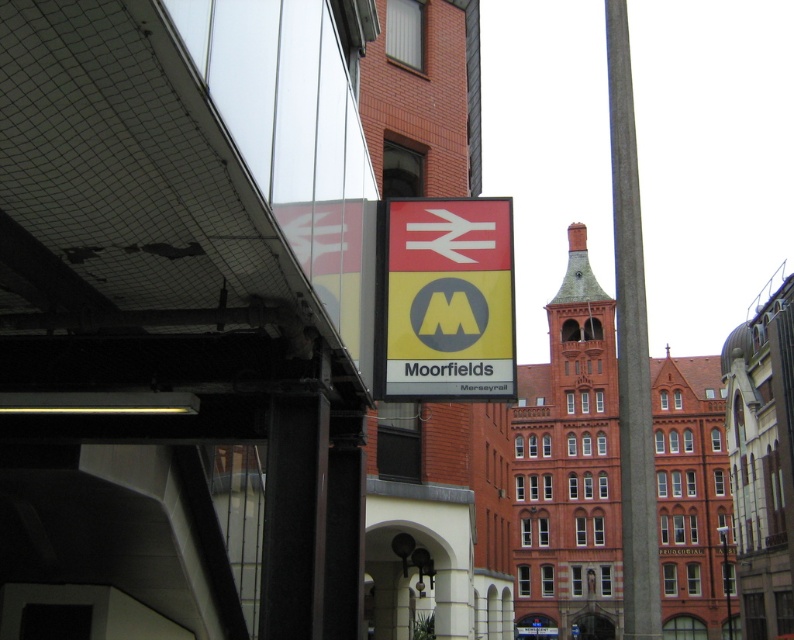
You are a passenger at the station and need to locate the yellow matte sign at center. Which object is closer to you if you are standing near the concrete pole at right?

The yellow matte sign at center is closer to you than the concrete pole at right because it is positioned at the center, while the concrete pole at right is further to the right side of the platform.

You are a delivery person trying to navigate through the station platform. You need to pass between the yellow matte sign at center and the concrete pole at right. Can you walk through the space between them without touching either?

The yellow matte sign at center has a lesser width compared to the concrete pole at right, so the space between them is sufficient for a person to walk through without touching either object.

You are a maintenance worker on the platform. You need to attach a new light fixture to the yellow matte sign at center and the concrete pole at right. Which object will require a taller ladder to reach its top?

The concrete pole at right requires a taller ladder because it has a greater height than the yellow matte sign at center.